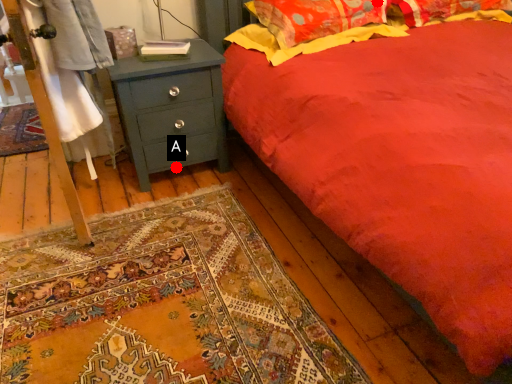
Question: Two points are circled on the image, labeled by A and B beside each circle. Among these points, which one is farthest from the camera?

Choices:
 (A) A is further
 (B) B is further

Answer: (A)